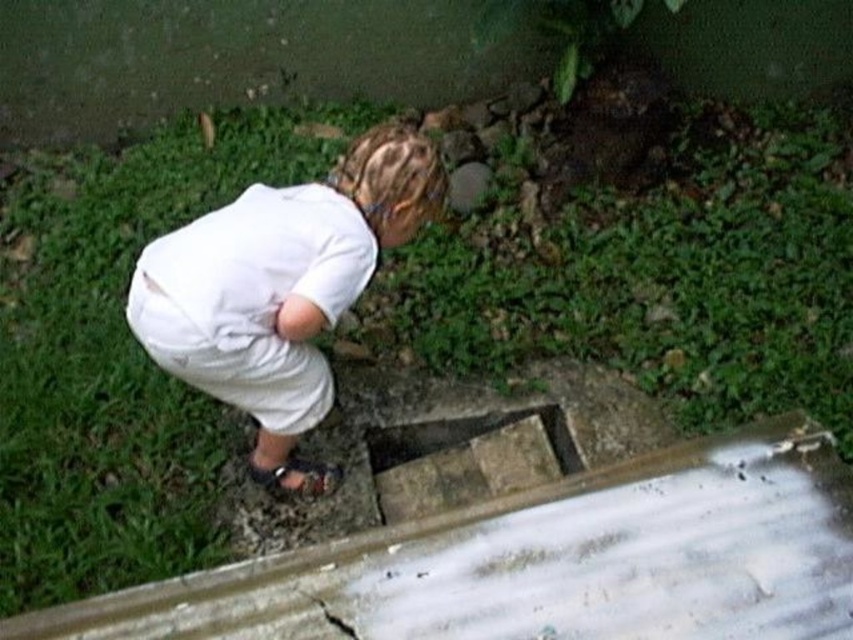
From the picture: Between white cotton shirt at center and concrete rectangular hole at center, which one has more height?

With more height is white cotton shirt at center.

Can you confirm if white cotton shirt at center is positioned above concrete rectangular hole at center?

Yes, white cotton shirt at center is above concrete rectangular hole at center.

You are a GUI agent. You are given a task and a screenshot of the screen. Output one action in this format:
    pyautogui.click(x=<x>, y=<y>)
    Task: Click on the white cotton shirt at center
    The width and height of the screenshot is (853, 640).
    Given the screenshot: What is the action you would take?
    pyautogui.click(x=280, y=280)

The width and height of the screenshot is (853, 640). Identify the location of white cotton shirt at center. (280, 280).

Can you confirm if brown leather sandal at lower center is positioned below black matte crack at lower center?

No, brown leather sandal at lower center is not below black matte crack at lower center.

Does brown leather sandal at lower center have a lesser height compared to black matte crack at lower center?

In fact, brown leather sandal at lower center may be taller than black matte crack at lower center.

Which is behind, point (289, 464) or point (309, 596)?

Positioned behind is point (289, 464).

What are the coordinates of `brown leather sandal at lower center` in the screenshot? It's located at (299, 477).

Which is behind, point (428, 432) or point (289, 465)?

The point (428, 432) is behind.

Does concrete rectangular hole at center have a lesser height compared to brown leather sandal at lower center?

No, concrete rectangular hole at center is not shorter than brown leather sandal at lower center.

This screenshot has width=853, height=640. Describe the element at coordinates (466, 460) in the screenshot. I see `concrete rectangular hole at center` at that location.

Where is `concrete rectangular hole at center`? concrete rectangular hole at center is located at coordinates (466, 460).